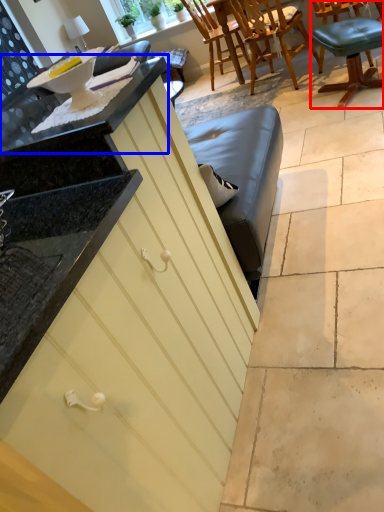
Question: Which point is closer to the camera, chair (highlighted by a red box) or countertop (highlighted by a blue box)?

Choices:
 (A) chair
 (B) countertop

Answer: (B)